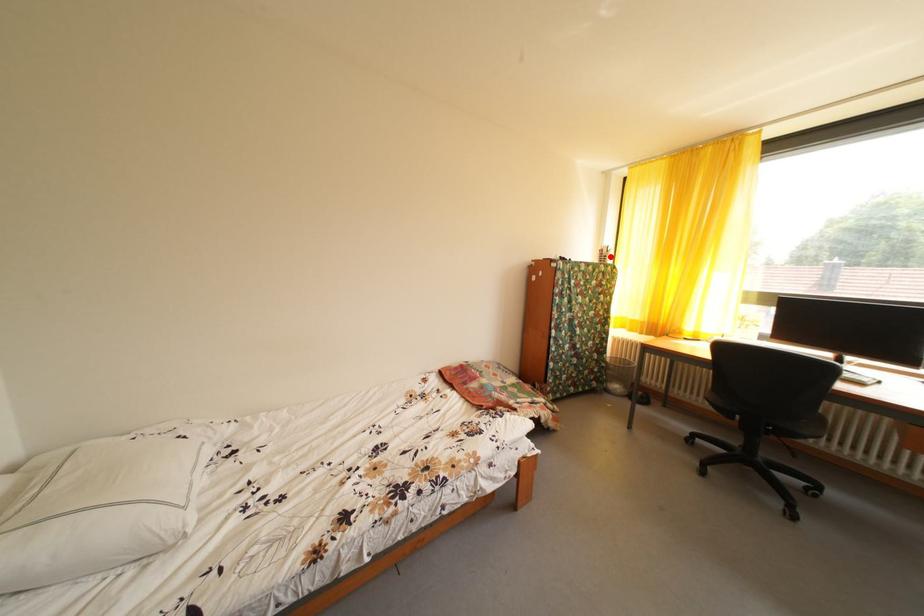
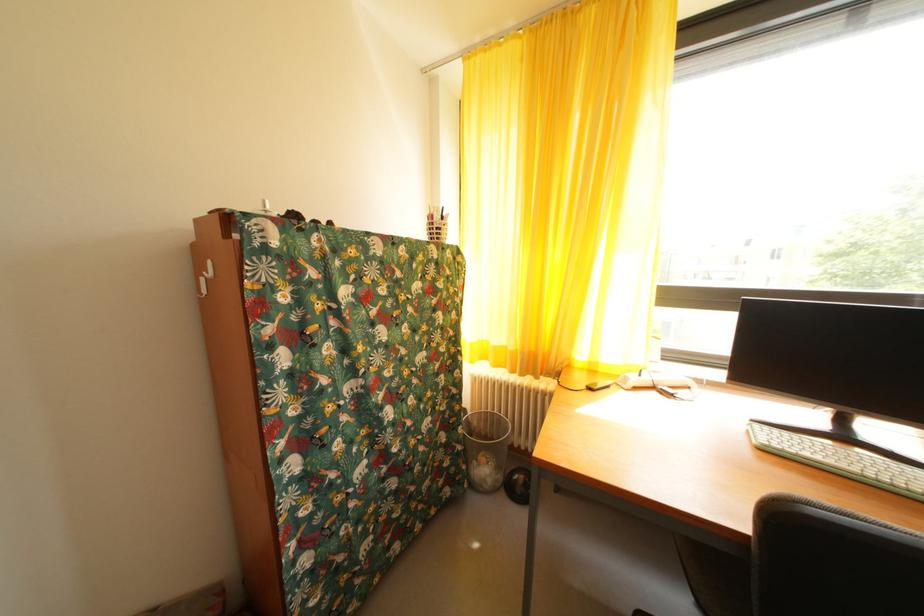
Locate, in the second image, the point that corresponds to the highlighted location in the first image.

(440, 223)